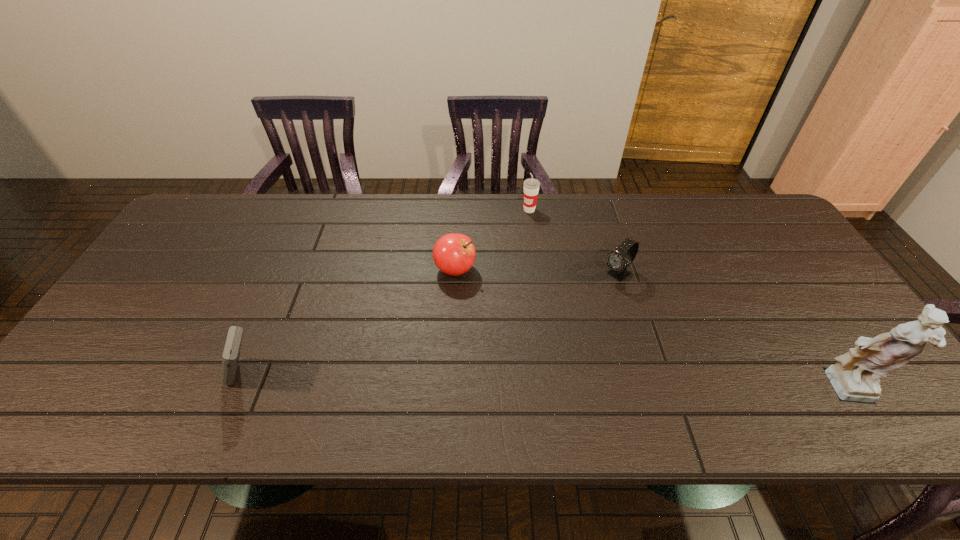
You are a GUI agent. You are given a task and a screenshot of the screen. Output one action in this format:
    pyautogui.click(x=<x>, y=<y>)
    Task: Click on the free space between the fourth object from right to left and the rightmost object
    This screenshot has height=540, width=960.
    Given the screenshot: What is the action you would take?
    pyautogui.click(x=650, y=330)

The image size is (960, 540). I want to click on vacant area that lies between the tallest object and the apple, so (x=650, y=330).

Image resolution: width=960 pixels, height=540 pixels. What are the coordinates of `blank region between the watch and the fourth object from right to left` in the screenshot? It's located at (537, 272).

At what (x,y) coordinates should I click in order to perform the action: click on free space between the rightmost object and the farthest object. Please return your answer as a coordinate pair (x, y). The width and height of the screenshot is (960, 540). Looking at the image, I should click on (687, 301).

Locate an element on the screen. empty location between the figurine and the calculator is located at coordinates (545, 384).

Find the location of a particular element. The height and width of the screenshot is (540, 960). empty space that is in between the figurine and the apple is located at coordinates (650, 330).

The height and width of the screenshot is (540, 960). What are the coordinates of `vacant area that lies between the figurine and the second object from left to right` in the screenshot? It's located at (650, 330).

The image size is (960, 540). What are the coordinates of `free space between the apple and the tallest object` in the screenshot? It's located at (650, 330).

Identify the location of free space between the figurine and the calculator. This screenshot has height=540, width=960. (545, 384).

Where is `object that can be found as the third closest to the rightmost object`? This screenshot has height=540, width=960. object that can be found as the third closest to the rightmost object is located at coordinates (454, 254).